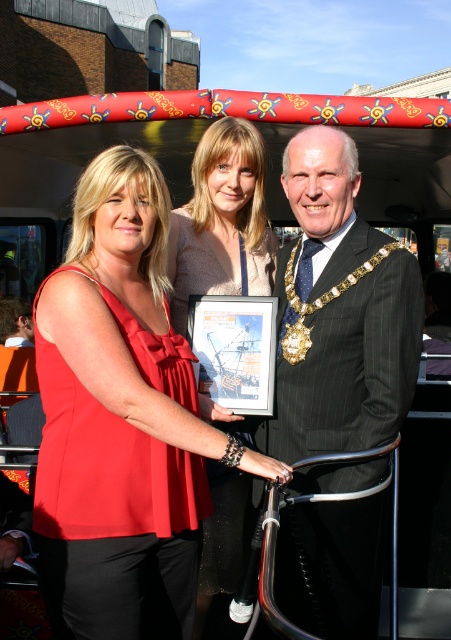
Who is lower down, matte red blouse at center or matte red dress at center?

matte red blouse at center is lower down.

Is matte red blouse at center above matte red dress at center?

No, matte red blouse at center is not above matte red dress at center.

Measure the distance between point (40,337) and camera.

Point (40,337) is 3.47 meters away from camera.

Locate an element on the screen. matte red blouse at center is located at coordinates (123, 419).

Which is more to the left, matte red blouse at center or black pinstripe suit at center?

Positioned to the left is matte red blouse at center.

Is matte red blouse at center bigger than black pinstripe suit at center?

Incorrect, matte red blouse at center is not larger than black pinstripe suit at center.

Which is in front, point (69, 584) or point (318, 472)?

Point (69, 584) is more forward.

Find the location of a particular element. This screenshot has width=451, height=640. matte red blouse at center is located at coordinates (123, 419).

Which is more to the right, black pinstripe suit at center or matte red dress at center?

black pinstripe suit at center

Describe the element at coordinates (340, 310) in the screenshot. I see `black pinstripe suit at center` at that location.

Who is more forward, [280,428] or [179,330]?

Point [280,428] is in front.

The image size is (451, 640). I want to click on black pinstripe suit at center, so click(340, 310).